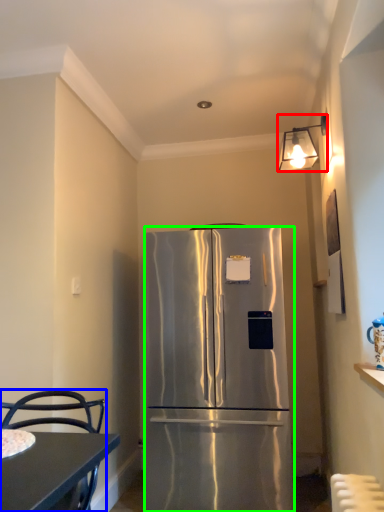
Question: Based on their relative distances, which object is nearer to lamp (highlighted by a red box)? Choose from chair (highlighted by a blue box) and refrigerator (highlighted by a green box).

Choices:
 (A) chair
 (B) refrigerator

Answer: (B)